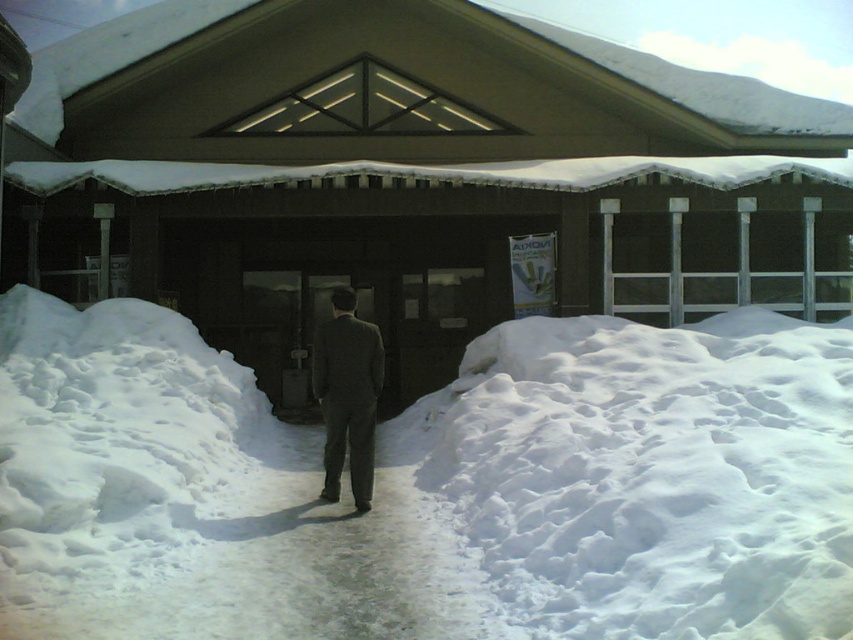
Which of these two, white fluffy snow at center or brown wooden hut at center, stands taller?

brown wooden hut at center is taller.

Between white fluffy snow at center and brown wooden hut at center, which one is positioned lower?

Positioned lower is white fluffy snow at center.

What do you see at coordinates (430, 486) in the screenshot? I see `white fluffy snow at center` at bounding box center [430, 486].

Locate an element on the screen. white fluffy snow at center is located at coordinates (430, 486).

Does white fluffy snow at center have a greater height compared to dark gray suit at center?

Correct, white fluffy snow at center is much taller as dark gray suit at center.

Is point (165, 596) positioned after point (340, 333)?

No.

Where is `white fluffy snow at center`? white fluffy snow at center is located at coordinates tap(430, 486).

Is point (85, 237) farther from viewer compared to point (341, 300)?

Yes, point (85, 237) is behind point (341, 300).

The width and height of the screenshot is (853, 640). Describe the element at coordinates (415, 179) in the screenshot. I see `brown wooden hut at center` at that location.

Identify the location of brown wooden hut at center. The image size is (853, 640). (415, 179).